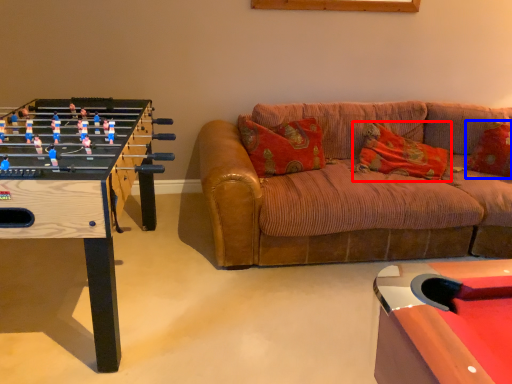
Question: Which point is further to the camera, pillow (highlighted by a red box) or pillow (highlighted by a blue box)?

Choices:
 (A) pillow
 (B) pillow

Answer: (B)